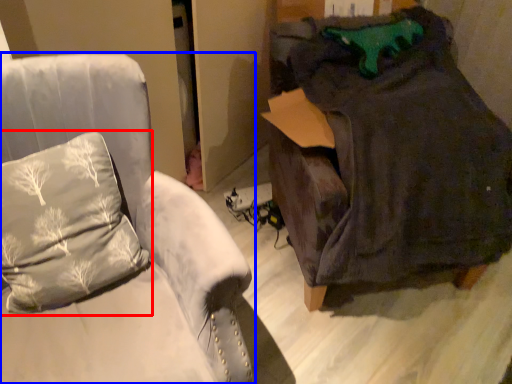
Question: Which object appears farthest to the camera in this image, pillow (highlighted by a red box) or furniture (highlighted by a blue box)?

Choices:
 (A) pillow
 (B) furniture

Answer: (A)